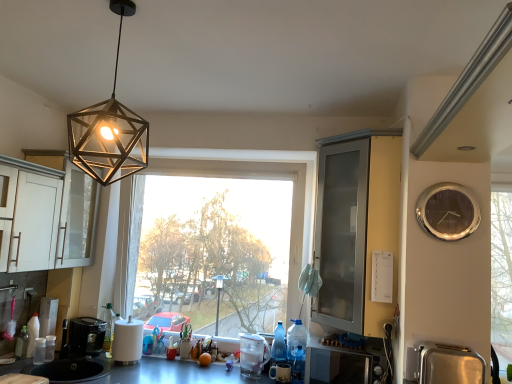
What do you see at coordinates (298, 366) in the screenshot?
I see `translucent blue bottle at lower center, which ranks as the 2th bottle in left-to-right order` at bounding box center [298, 366].

Locate an element on the screen. white matte paper towel holder at center, marked as the first appliance in a back-to-front arrangement is located at coordinates (127, 341).

Image resolution: width=512 pixels, height=384 pixels. What do you see at coordinates (127, 341) in the screenshot?
I see `white matte paper towel holder at center, placed as the first appliance when sorted from left to right` at bounding box center [127, 341].

This screenshot has width=512, height=384. What are the coordinates of `white glossy cabinet at left` in the screenshot? It's located at (34, 216).

The height and width of the screenshot is (384, 512). Describe the element at coordinates (345, 363) in the screenshot. I see `white glossy microwave at lower center, the 2th appliance viewed from the right` at that location.

Locate an element on the screen. Image resolution: width=512 pixels, height=384 pixels. metallic hexagonal light fixture at upper center is located at coordinates (109, 130).

Is metallic gray countertop at lower center thinner than white glossy microwave at lower center, which is counted as the third appliance, starting from the back?

Incorrect, the width of metallic gray countertop at lower center is not less than that of white glossy microwave at lower center, which is counted as the third appliance, starting from the back.

Would you say metallic gray countertop at lower center is inside or outside white glossy microwave at lower center, the 2th appliance viewed from the right?

metallic gray countertop at lower center lies outside white glossy microwave at lower center, the 2th appliance viewed from the right.

Can you confirm if metallic gray countertop at lower center is smaller than white glossy microwave at lower center, the 2th appliance positioned from the front?

Incorrect, metallic gray countertop at lower center is not smaller in size than white glossy microwave at lower center, the 2th appliance positioned from the front.

Is clear glass cabinet at right in contact with black plastic coffee machine at lower left?

No, clear glass cabinet at right is not making contact with black plastic coffee machine at lower left.

Does clear glass cabinet at right turn towards black plastic coffee machine at lower left?

Yes, clear glass cabinet at right faces towards black plastic coffee machine at lower left.

Considering the relative sizes of clear glass cabinet at right and black plastic coffee machine at lower left in the image provided, is clear glass cabinet at right thinner than black plastic coffee machine at lower left?

In fact, clear glass cabinet at right might be wider than black plastic coffee machine at lower left.

Find the location of a particular element. This screenshot has height=384, width=512. screen door above the black plastic coffee machine at lower left (from the image's perspective) is located at coordinates (341, 234).

At what (x,y) coordinates should I click in order to perform the action: click on screen door above the transparent glass window at center (from the image's perspective). Please return your answer as a coordinate pair (x, y). This screenshot has height=384, width=512. Looking at the image, I should click on (341, 234).

Between transparent glass window at center and clear glass cabinet at right, which one has larger size?

transparent glass window at center.

Can you confirm if transparent glass window at center is positioned to the left of clear glass cabinet at right?

Yes.

Can you confirm if silver metallic exhaust hood at upper right is smaller than translucent plastic bottle at lower left, which ranks as the second bottle in front-to-back order?

No.

From the image's perspective, is silver metallic exhaust hood at upper right over translucent plastic bottle at lower left, which ranks as the second bottle in front-to-back order?

Yes, from the image's perspective, silver metallic exhaust hood at upper right is over translucent plastic bottle at lower left, which ranks as the second bottle in front-to-back order.

Can we say silver metallic exhaust hood at upper right lies outside translucent plastic bottle at lower left, arranged as the 1th bottle when viewed from the back?

Indeed, silver metallic exhaust hood at upper right is completely outside translucent plastic bottle at lower left, arranged as the 1th bottle when viewed from the back.

Between black plastic coffee machine at lower left and white glossy cabinet at left, which one has more height?

With more height is white glossy cabinet at left.

Would you say black plastic coffee machine at lower left is a long distance from white glossy cabinet at left?

No, black plastic coffee machine at lower left is not far from white glossy cabinet at left.

Which is more to the left, black plastic coffee machine at lower left or white glossy cabinet at left?

Positioned to the left is white glossy cabinet at left.

From a real-world perspective, is black plastic coffee machine at lower left over white glossy cabinet at left?

Incorrect, from a real-world perspective, black plastic coffee machine at lower left is lower than white glossy cabinet at left.

Considering the relative sizes of silver metallic clock at right and translucent blue bottle at lower center, the 1th bottle positioned from the front, in the image provided, is silver metallic clock at right bigger than translucent blue bottle at lower center, the 1th bottle positioned from the front,?

Yes, silver metallic clock at right is bigger than translucent blue bottle at lower center, the 1th bottle positioned from the front.

Would you say silver metallic clock at right is outside translucent blue bottle at lower center, the 1th bottle positioned from the front?

silver metallic clock at right is positioned outside translucent blue bottle at lower center, the 1th bottle positioned from the front.

How different are the orientations of silver metallic clock at right and translucent blue bottle at lower center, acting as the second bottle starting from the back, in degrees?

The angle between the facing direction of silver metallic clock at right and the facing direction of translucent blue bottle at lower center, acting as the second bottle starting from the back, is 8.75 degrees.

Which object is further away from the camera taking this photo, silver metallic clock at right or translucent blue bottle at lower center, acting as the second bottle starting from the back?

Positioned behind is translucent blue bottle at lower center, acting as the second bottle starting from the back.

Considering the relative positions of white matte paper towel holder at center, the 4th appliance from the right, and white glossy microwave at lower center, the 2th appliance viewed from the right, in the image provided, is white matte paper towel holder at center, the 4th appliance from the right, to the right of white glossy microwave at lower center, the 2th appliance viewed from the right, from the viewer's perspective?

In fact, white matte paper towel holder at center, the 4th appliance from the right, is to the left of white glossy microwave at lower center, the 2th appliance viewed from the right.

Looking at this image, from a real-world perspective, is white matte paper towel holder at center, the fourth appliance when ordered from front to back, located higher than white glossy microwave at lower center, the 2th appliance positioned from the front?

Yes, from a real-world perspective, white matte paper towel holder at center, the fourth appliance when ordered from front to back, is above white glossy microwave at lower center, the 2th appliance positioned from the front.

Can you confirm if white matte paper towel holder at center, the fourth appliance when ordered from front to back, is taller than white glossy microwave at lower center, the 2th appliance viewed from the right?

Correct, white matte paper towel holder at center, the fourth appliance when ordered from front to back, is much taller as white glossy microwave at lower center, the 2th appliance viewed from the right.

Identify the location of countertop in front of the white glossy microwave at lower center, the third appliance from the left. (175, 373).

There is a black plastic coffee machine at lower left. Where is `screen door above it (from a real-world perspective)`? screen door above it (from a real-world perspective) is located at coordinates (341, 234).

From the image, which object appears to be farther from transparent glass window at center, translucent blue bottle at lower center, the 1th bottle positioned from the front, or clear plastic blender at center, placed as the third appliance when sorted from front to back?

translucent blue bottle at lower center, the 1th bottle positioned from the front, is positioned further to the anchor transparent glass window at center.

Looking at the image, which one is located further to metallic gray countertop at lower center, black plastic coffee machine at lower left or silver metallic toaster at lower right, positioned as the fourth appliance in left-to-right order?

silver metallic toaster at lower right, positioned as the fourth appliance in left-to-right order, is further to metallic gray countertop at lower center.

Looking at the image, which one is located further to silver metallic clock at right, translucent blue bottle at lower center, acting as the second bottle starting from the back, or silver metallic exhaust hood at upper right?

translucent blue bottle at lower center, acting as the second bottle starting from the back, is positioned further to the anchor silver metallic clock at right.

Which object lies further to the anchor point clear plastic blender at center, placed as the third appliance when sorted from front to back, white matte paper towel holder at center, placed as the first appliance when sorted from left to right, or black plastic coffee machine at lower left?

black plastic coffee machine at lower left is positioned further to the anchor clear plastic blender at center, placed as the third appliance when sorted from front to back.

Estimate the real-world distances between objects in this image. Which object is further from translucent blue bottle at lower center, the 1th bottle positioned from the front, metallic hexagonal light fixture at upper center or black plastic coffee machine at lower left?

metallic hexagonal light fixture at upper center is positioned further to the anchor translucent blue bottle at lower center, the 1th bottle positioned from the front.

Looking at the image, which one is located closer to white matte paper towel holder at center, placed as the first appliance when sorted from left to right, metallic hexagonal light fixture at upper center or metallic gray countertop at lower center?

metallic gray countertop at lower center lies closer to white matte paper towel holder at center, placed as the first appliance when sorted from left to right, than the other object.

When comparing their distances from clear plastic blender at center, placed as the third appliance when sorted from front to back, does translucent plastic bottle at lower left, placed as the 2th bottle when sorted from right to left, or white glossy cabinet at left seem further?

white glossy cabinet at left is further to clear plastic blender at center, placed as the third appliance when sorted from front to back.

When comparing their distances from metallic gray countertop at lower center, does white matte paper towel holder at center, the fourth appliance when ordered from front to back, or clear plastic blender at center, which is the second appliance in left-to-right order, seem closer?

The object closer to metallic gray countertop at lower center is white matte paper towel holder at center, the fourth appliance when ordered from front to back.

Find the location of a particular element. The height and width of the screenshot is (384, 512). countertop between white glossy cabinet at left and clear plastic blender at center, which is the 2th appliance from back to front, from left to right is located at coordinates (175, 373).

You are a GUI agent. You are given a task and a screenshot of the screen. Output one action in this format:
    pyautogui.click(x=<x>, y=<y>)
    Task: Click on the bottle between white glossy cabinet at left and silver metallic exhaust hood at upper right
    This screenshot has height=384, width=512.
    Given the screenshot: What is the action you would take?
    pyautogui.click(x=298, y=366)

Image resolution: width=512 pixels, height=384 pixels. I want to click on window between translucent plastic bottle at lower left, arranged as the 1th bottle when viewed from the back, and clear glass cabinet at right, in the horizontal direction, so click(x=251, y=178).

This screenshot has height=384, width=512. Identify the location of lamp between translucent plastic bottle at lower left, which ranks as the second bottle in front-to-back order, and white glossy microwave at lower center, the 2th appliance positioned from the front, from left to right. (109, 130).